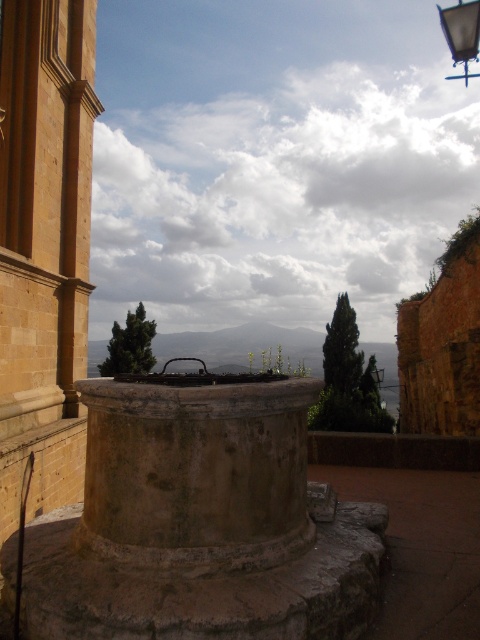
Does rustic stone well at center appear on the right side of metallic streetlight at upper right?

No, rustic stone well at center is not to the right of metallic streetlight at upper right.

Can you confirm if rustic stone well at center is thinner than metallic streetlight at upper right?

Yes.

Where is `rustic stone well at center`? This screenshot has height=640, width=480. rustic stone well at center is located at coordinates (196, 472).